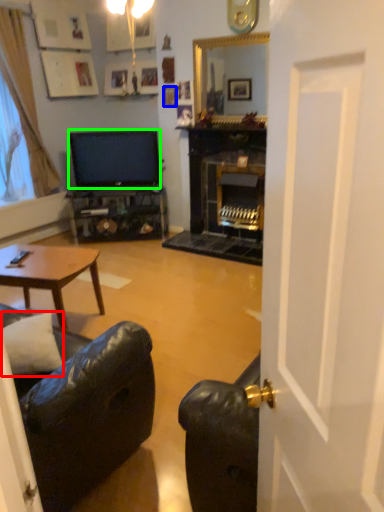
Question: Based on their relative distances, which object is farther from pillow (highlighted by a red box)? Choose from picture frame (highlighted by a blue box) and television (highlighted by a green box).

Choices:
 (A) picture frame
 (B) television

Answer: (A)